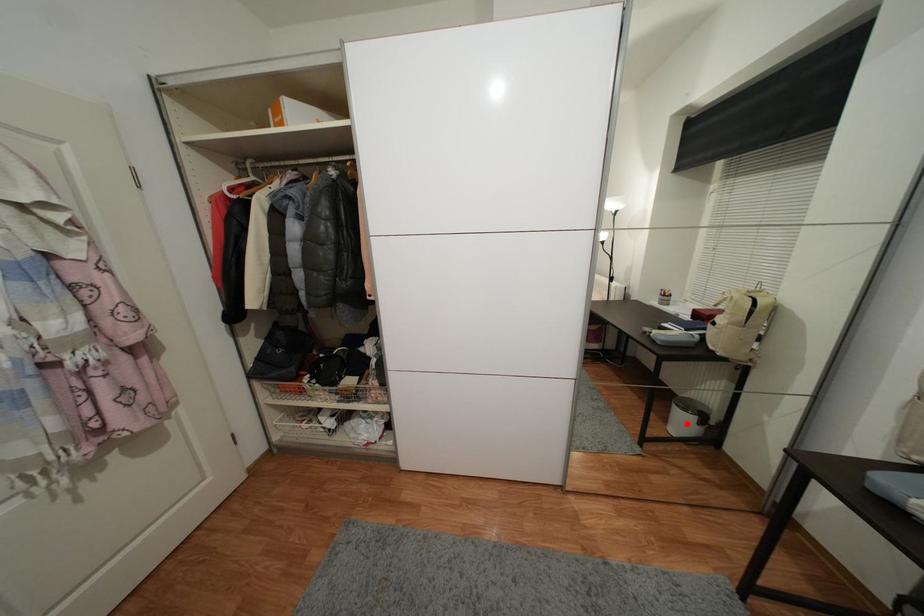
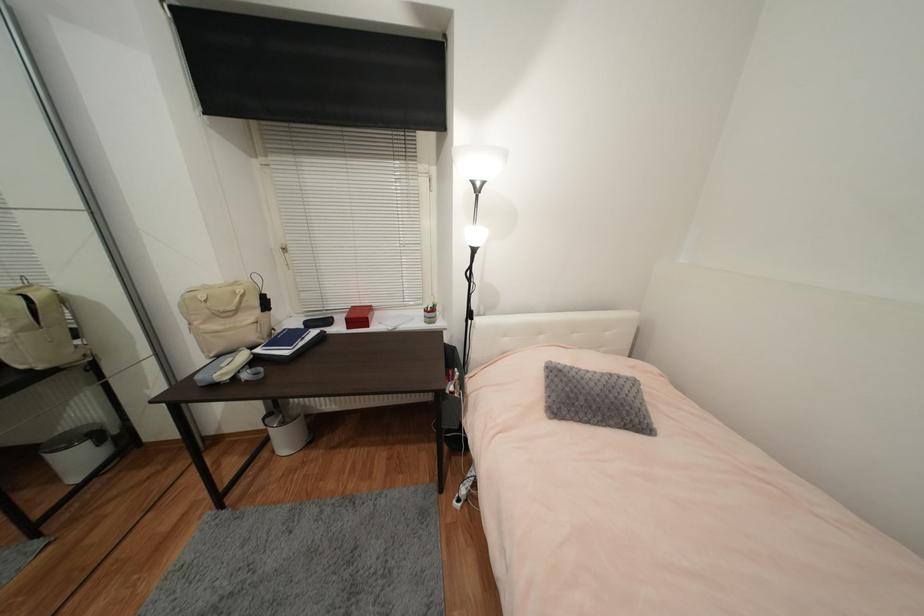
Question: I am providing you with two images of the same scene from different viewpoints. Image1 has a red point marked. In image2, the corresponding 3D location appears at what relative position? Reply with the corresponding letter.

Choices:
 (A) Closer
 (B) Farther

Answer: (B)